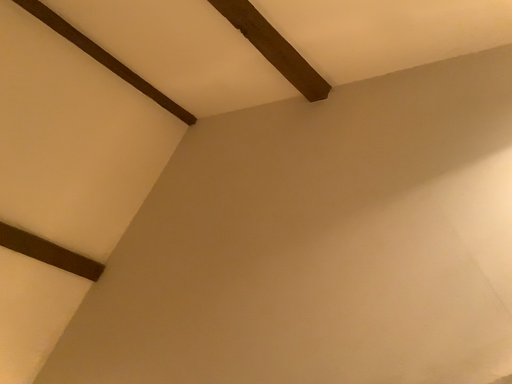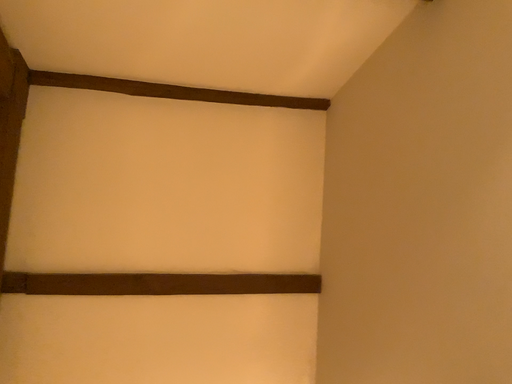
Question: How did the camera likely rotate when shooting the video?

Choices:
 (A) rotated left
 (B) rotated right

Answer: (A)